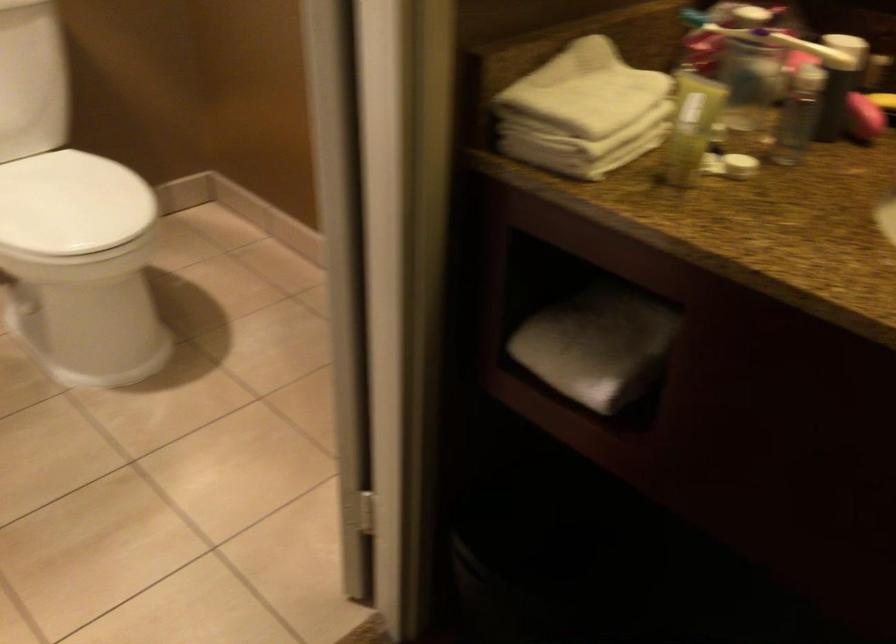
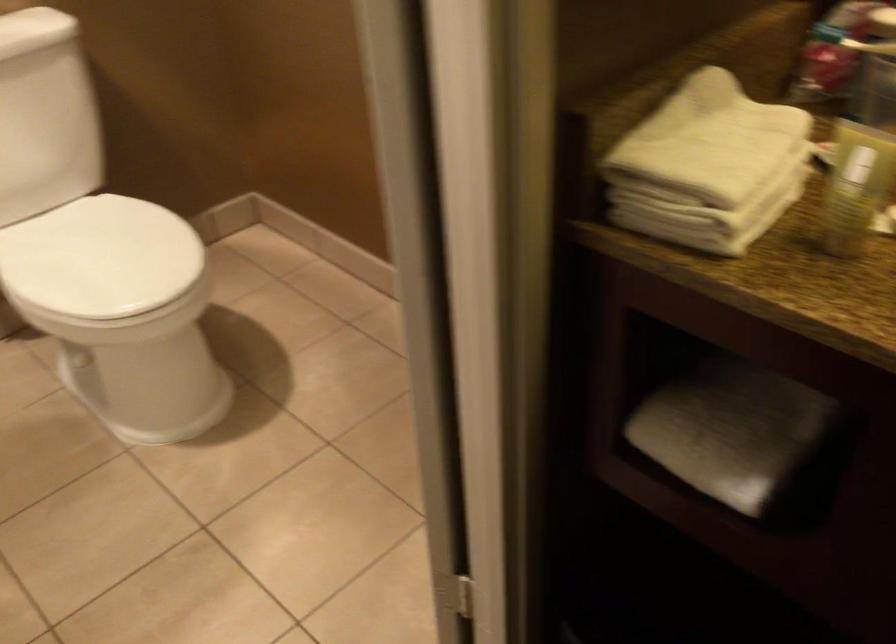
In the second image, find the point that corresponds to (684,140) in the first image.

(849, 204)